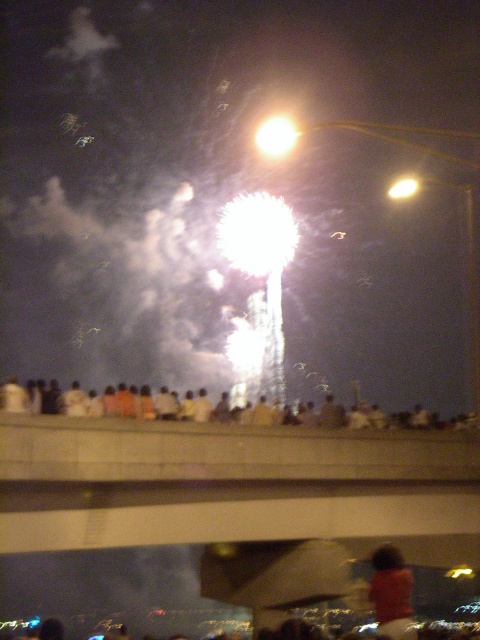
Who is positioned more to the right, white cotton shirt at lower center or orange fabric shirt at center?

white cotton shirt at lower center is more to the right.

How distant is white cotton shirt at lower center from orange fabric shirt at center?

A distance of 35.74 feet exists between white cotton shirt at lower center and orange fabric shirt at center.

Is point (354, 417) more distant than point (405, 570)?

That is True.

Identify the location of white cotton shirt at lower center. (214, 408).